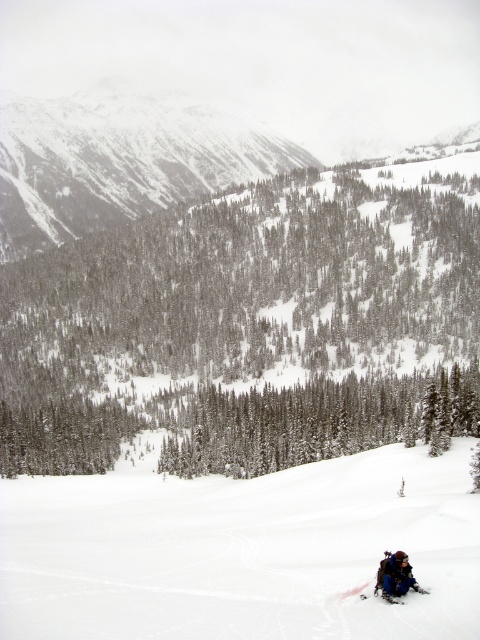
Question: Among these points, which one is nearest to the camera?

Choices:
 (A) (13, 632)
 (B) (109, 177)
 (C) (147, 298)
 (D) (405, 566)

Answer: (A)

Question: Which point is farther to the camera?

Choices:
 (A) white snow ski slope at lower right
 (B) blue fabric snowsuit at lower right
 (C) snowy rocky mountain at upper left

Answer: (C)

Question: Is snow-covered evergreen tree at center smaller than blue fabric snowsuit at lower right?

Choices:
 (A) yes
 (B) no

Answer: (B)

Question: Among these points, which one is nearest to the camera?

Choices:
 (A) (218, 336)
 (B) (397, 579)
 (C) (175, 129)

Answer: (B)

Question: Does snow-covered evergreen tree at center have a larger size compared to white snow ski slope at lower right?

Choices:
 (A) no
 (B) yes

Answer: (B)

Question: Is snow-covered evergreen tree at center wider than snowy rocky mountain at upper left?

Choices:
 (A) yes
 (B) no

Answer: (B)